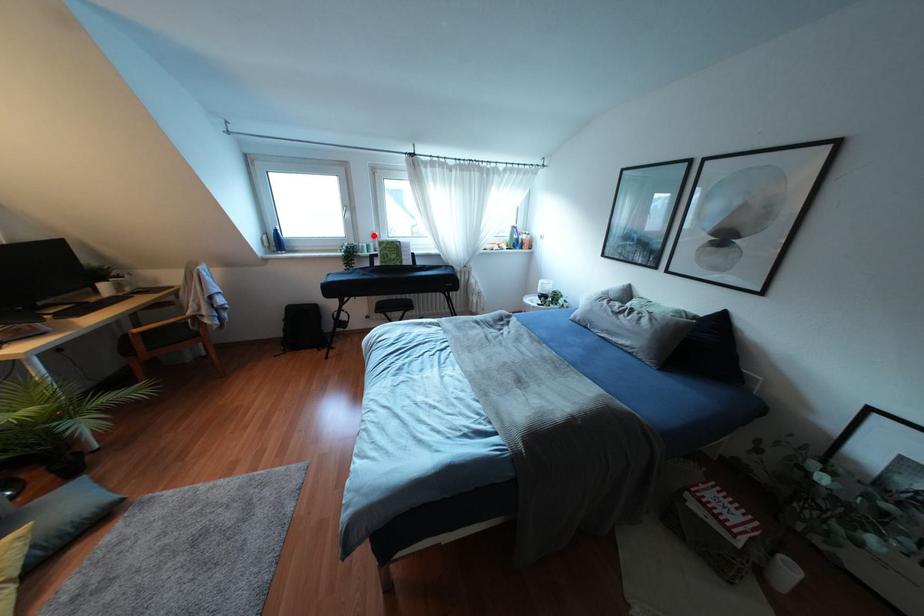
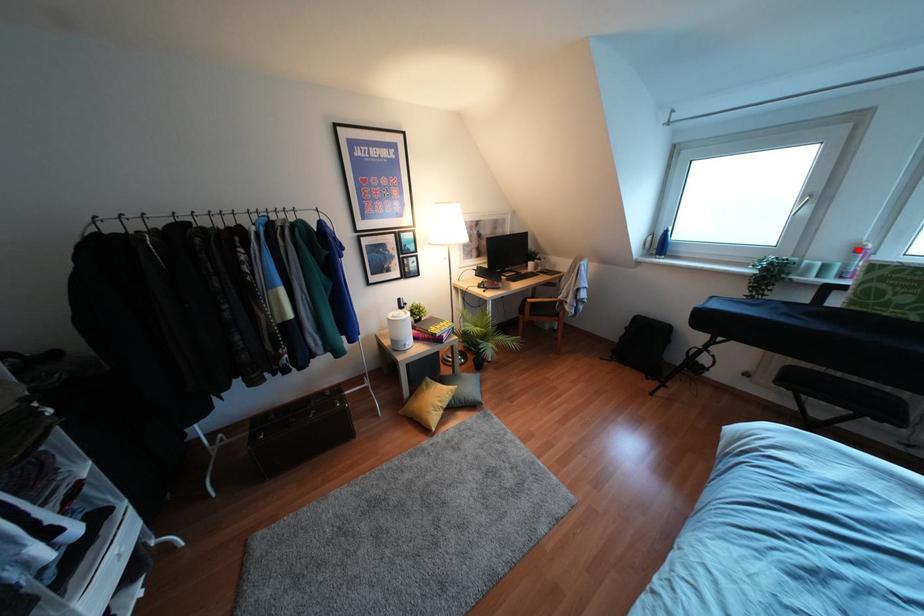
I am providing you with two images of the same scene from different viewpoints. A red point is marked on the first image and another point is marked on the second image. Does the point marked in image1 correspond to the same location as the one in image2?

Yes